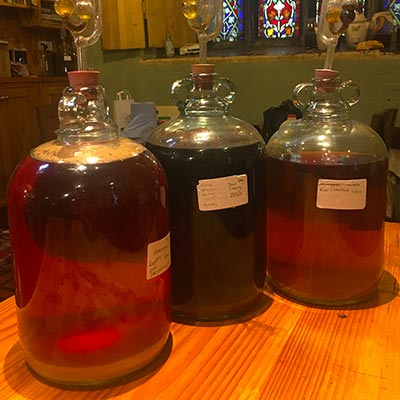
This screenshot has width=400, height=400. Find the location of `wooden window drawers`. wooden window drawers is located at coordinates (116, 12), (160, 21).